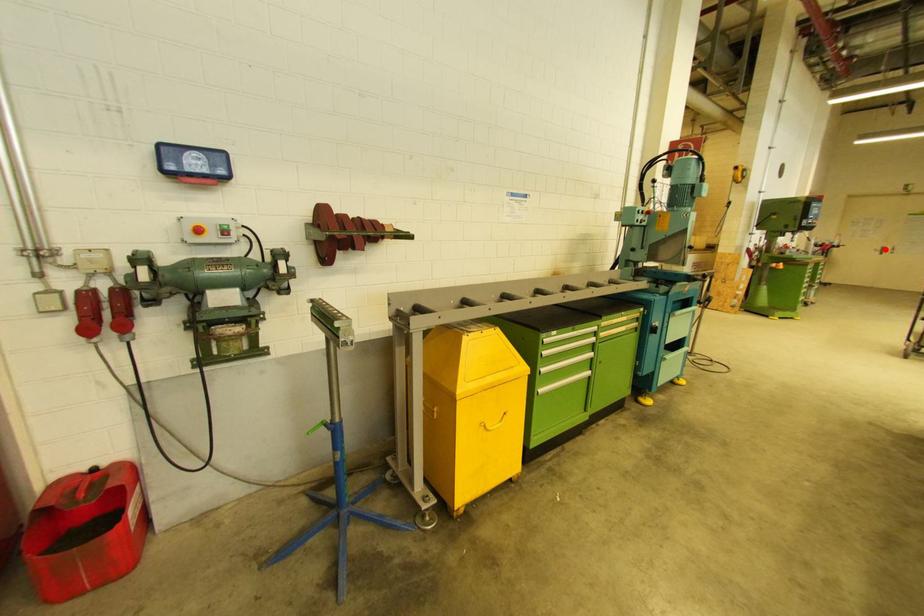
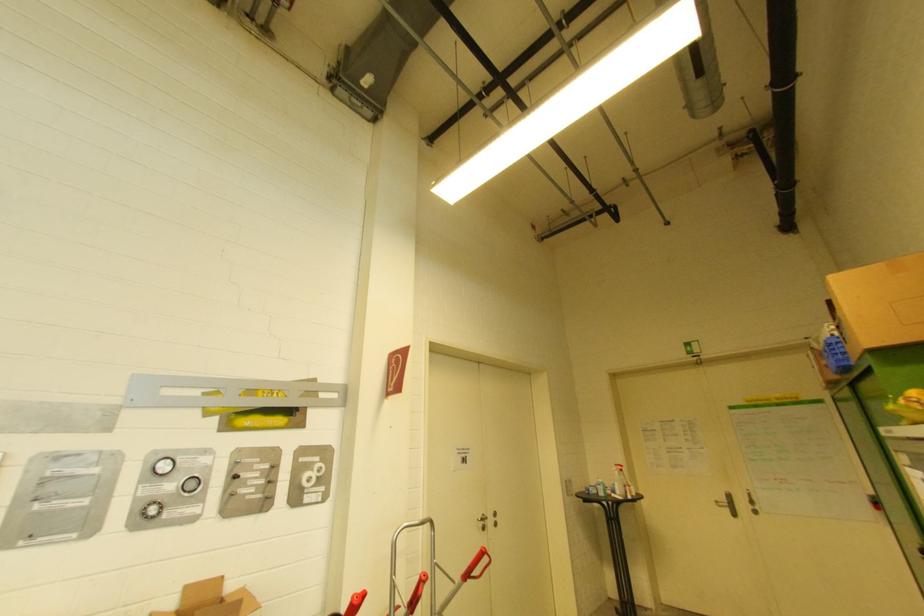
Locate, in the second image, the point that corresponds to the highlighted location in the first image.

(731, 498)